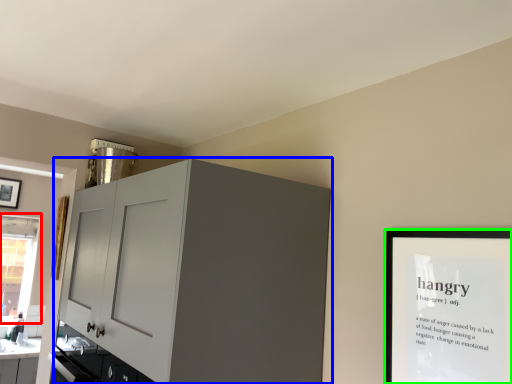
Question: Which object is positioned closest to window (highlighted by a red box)? Select from cabinetry (highlighted by a blue box) and picture frame (highlighted by a green box).

Choices:
 (A) cabinetry
 (B) picture frame

Answer: (A)